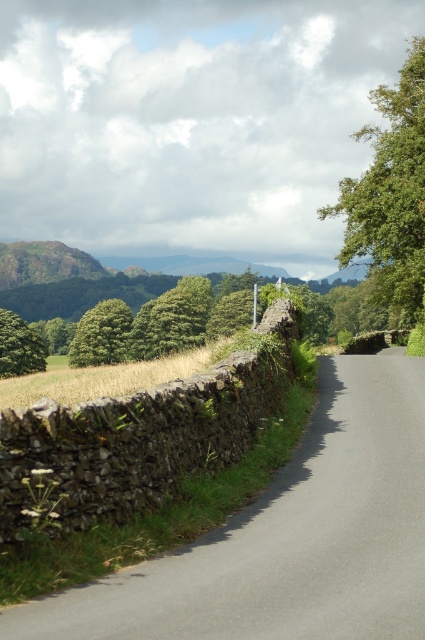
You are a landscape architect analyzing the image. You need to determine which object takes up more space in the scene. Based on the provided information, which one is larger in area between the smooth asphalt road at center and the green leafy tree at left?

The green leafy tree at left occupies more space than the smooth asphalt road at center according to the description.

You are driving a car and want to stay on the smooth asphalt road at center while avoiding obstacles. Which direction should you steer to keep the green leafy tree at upper right out of your path?

The green leafy tree at upper right is further away from the viewer than the smooth asphalt road at center. To stay on the road and avoid the tree, steer towards the side opposite the tree, keeping the road center in focus.

Consider the image. You are a hiker standing at the center of the winding road and want to determine which tree is closer to you. The trees in question are the green leafy tree at upper right and the green leafy tree at left. Based on their sizes, which one is nearer?

The green leafy tree at upper right is bigger than the green leafy tree at left, so the green leafy tree at upper right is closer to you because larger objects in a scene typically appear closer when they are actually larger or positioned nearer.